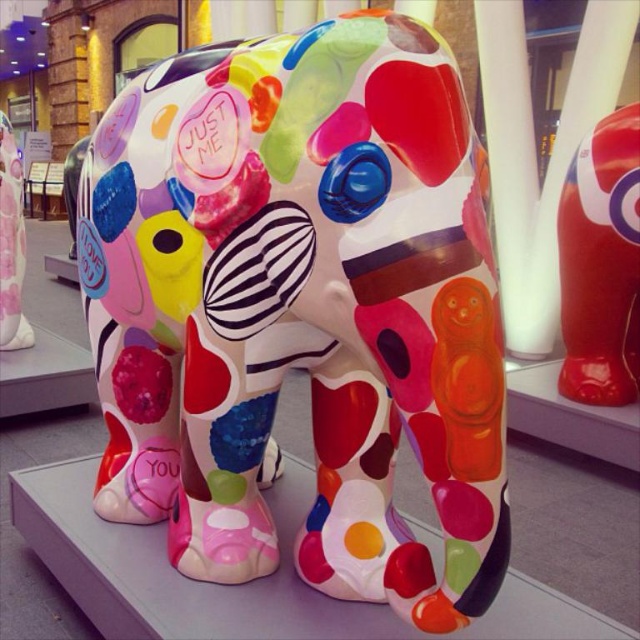
Which of these two, white glossy pillar at center or matte plastic elephant at center, stands taller?

With more height is white glossy pillar at center.

Can you confirm if white glossy pillar at center is positioned below matte plastic elephant at center?

Actually, white glossy pillar at center is above matte plastic elephant at center.

Is point (545, 211) more distant than point (16, 272)?

Yes, point (545, 211) is farther from viewer.

The image size is (640, 640). What are the coordinates of `white glossy pillar at center` in the screenshot? It's located at (516, 182).

Can you confirm if multicolored glossy elephant at center is positioned to the left of white glossy pillar at center?

Correct, you'll find multicolored glossy elephant at center to the left of white glossy pillar at center.

Is multicolored glossy elephant at center shorter than white glossy pillar at center?

Yes.

What do you see at coordinates (300, 308) in the screenshot? The width and height of the screenshot is (640, 640). I see `multicolored glossy elephant at center` at bounding box center [300, 308].

Find the location of a particular element. The width and height of the screenshot is (640, 640). multicolored glossy elephant at center is located at coordinates (300, 308).

Can you confirm if multicolored glossy elephant at center is positioned below shiny red elephant at center?

Yes.

Image resolution: width=640 pixels, height=640 pixels. Describe the element at coordinates (300, 308) in the screenshot. I see `multicolored glossy elephant at center` at that location.

What do you see at coordinates (300, 308) in the screenshot?
I see `multicolored glossy elephant at center` at bounding box center [300, 308].

Where is `multicolored glossy elephant at center`? multicolored glossy elephant at center is located at coordinates (300, 308).